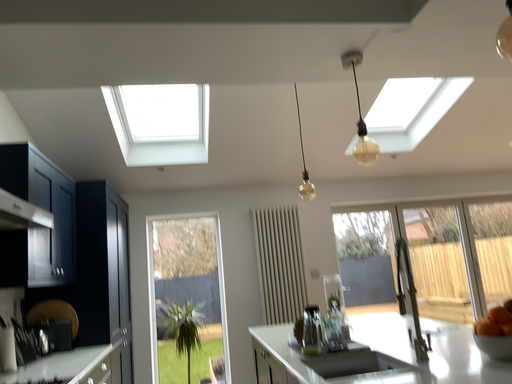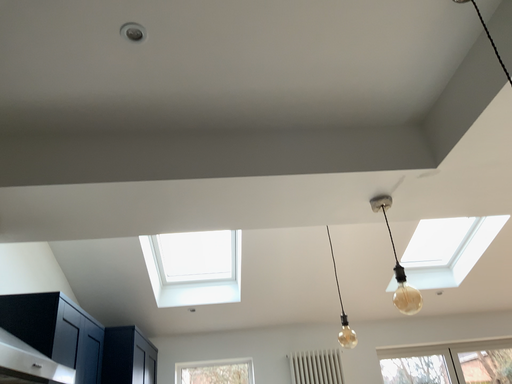
Question: How did the camera likely rotate when shooting the video?

Choices:
 (A) rotated upward
 (B) rotated downward

Answer: (A)